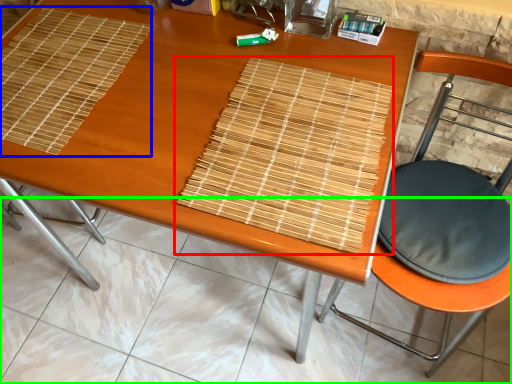
Question: Estimate the real-world distances between objects in this image. Which object is closer to mat (highlighted by a red box), mat (highlighted by a blue box) or tile (highlighted by a green box)?

Choices:
 (A) mat
 (B) tile

Answer: (A)